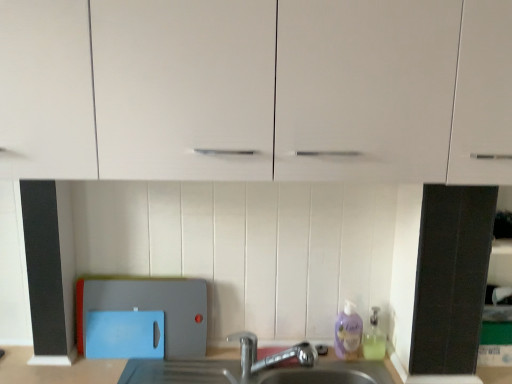
Find the location of a particular element. purple translucent liquid soap at lower right, the 2th cleaning product when ordered from right to left is located at coordinates (348, 333).

Image resolution: width=512 pixels, height=384 pixels. What are the coordinates of `purple translucent liquid soap at lower right, which is counted as the 1th cleaning product, starting from the left` in the screenshot? It's located at (348, 333).

In the image, is translucent plastic soap dispenser at lower right, which appears as the second cleaning product when viewed from the left, positioned in front of or behind purple translucent liquid soap at lower right, which is counted as the 1th cleaning product, starting from the left?

translucent plastic soap dispenser at lower right, which appears as the second cleaning product when viewed from the left, is positioned closer to the viewer than purple translucent liquid soap at lower right, which is counted as the 1th cleaning product, starting from the left.

Is translucent plastic soap dispenser at lower right, which appears as the second cleaning product when viewed from the left, next to purple translucent liquid soap at lower right, which is counted as the 1th cleaning product, starting from the left?

Yes, translucent plastic soap dispenser at lower right, which appears as the second cleaning product when viewed from the left, is with purple translucent liquid soap at lower right, which is counted as the 1th cleaning product, starting from the left.

Considering the sizes of objects translucent plastic soap dispenser at lower right, which appears as the second cleaning product when viewed from the left, and purple translucent liquid soap at lower right, the 2th cleaning product when ordered from right to left, in the image provided, who is taller, translucent plastic soap dispenser at lower right, which appears as the second cleaning product when viewed from the left, or purple translucent liquid soap at lower right, the 2th cleaning product when ordered from right to left,?

purple translucent liquid soap at lower right, the 2th cleaning product when ordered from right to left.

Locate an element on the screen. The height and width of the screenshot is (384, 512). appliance located above the silver metallic faucet at lower center (from a real-world perspective) is located at coordinates (150, 307).

Is silver metallic faucet at lower center wider than blue plastic cutting board at lower left?

Indeed, silver metallic faucet at lower center has a greater width compared to blue plastic cutting board at lower left.

Can you confirm if silver metallic faucet at lower center is shorter than blue plastic cutting board at lower left?

Correct, silver metallic faucet at lower center is not as tall as blue plastic cutting board at lower left.

Considering the points (256, 350) and (166, 318), which point is behind, point (256, 350) or point (166, 318)?

The point (256, 350) is farther from the camera.

Can you confirm if blue plastic cutting board at lower left is wider than silver metallic faucet at lower center?

No, blue plastic cutting board at lower left is not wider than silver metallic faucet at lower center.

Between blue plastic cutting board at lower left and silver metallic faucet at lower center, which one has more height?

blue plastic cutting board at lower left is taller.

The image size is (512, 384). What are the coordinates of `appliance behind the silver metallic faucet at lower center` in the screenshot? It's located at coord(150,307).

Does blue plastic cutting board at lower left contain silver metallic faucet at lower center?

No, silver metallic faucet at lower center is not surrounded by blue plastic cutting board at lower left.

Would you say white glossy cabinet at upper center is inside or outside purple translucent liquid soap at lower right, which is counted as the 1th cleaning product, starting from the left?

white glossy cabinet at upper center is not enclosed by purple translucent liquid soap at lower right, which is counted as the 1th cleaning product, starting from the left.

Based on their positions, is white glossy cabinet at upper center located to the left or right of purple translucent liquid soap at lower right, which is counted as the 1th cleaning product, starting from the left?

Based on their positions, white glossy cabinet at upper center is located to the left of purple translucent liquid soap at lower right, which is counted as the 1th cleaning product, starting from the left.

Considering the sizes of white glossy cabinet at upper center and purple translucent liquid soap at lower right, which is counted as the 1th cleaning product, starting from the left, in the image, is white glossy cabinet at upper center bigger or smaller than purple translucent liquid soap at lower right, which is counted as the 1th cleaning product, starting from the left,?

white glossy cabinet at upper center is bigger than purple translucent liquid soap at lower right, which is counted as the 1th cleaning product, starting from the left.

Considering their positions, is white glossy cabinet at upper center located in front of or behind purple translucent liquid soap at lower right, the 2th cleaning product when ordered from right to left?

Visually, white glossy cabinet at upper center is located in front of purple translucent liquid soap at lower right, the 2th cleaning product when ordered from right to left.

Is white glossy cabinet at upper center outside of translucent plastic soap dispenser at lower right, which is counted as the 1th cleaning product, starting from the right?

Indeed, white glossy cabinet at upper center is completely outside translucent plastic soap dispenser at lower right, which is counted as the 1th cleaning product, starting from the right.

Is white glossy cabinet at upper center beside translucent plastic soap dispenser at lower right, which appears as the second cleaning product when viewed from the left?

No, white glossy cabinet at upper center is not in contact with translucent plastic soap dispenser at lower right, which appears as the second cleaning product when viewed from the left.

Is white glossy cabinet at upper center smaller than translucent plastic soap dispenser at lower right, which is counted as the 1th cleaning product, starting from the right?

No.

From the image's perspective, is white glossy cabinet at upper center beneath translucent plastic soap dispenser at lower right, which appears as the second cleaning product when viewed from the left?

Actually, white glossy cabinet at upper center appears above translucent plastic soap dispenser at lower right, which appears as the second cleaning product when viewed from the left, in the image.

Between white glossy cabinet at upper center and silver metallic faucet at lower center, which one is positioned behind?

silver metallic faucet at lower center is more distant.

From a real-world perspective, who is located higher, white glossy cabinet at upper center or silver metallic faucet at lower center?

white glossy cabinet at upper center is physically above.

This screenshot has height=384, width=512. I want to click on tap below the white glossy cabinet at upper center (from the image's perspective), so click(271, 355).

Considering the relative positions of white glossy cabinet at upper center and silver metallic faucet at lower center in the image provided, is white glossy cabinet at upper center to the right of silver metallic faucet at lower center from the viewer's perspective?

No.

From a real-world perspective, is silver metallic faucet at lower center on top of white glossy cabinet at upper center?

Actually, silver metallic faucet at lower center is physically below white glossy cabinet at upper center in the real world.

Who is more distant, silver metallic faucet at lower center or white glossy cabinet at upper center?

silver metallic faucet at lower center is further from the camera.

Image resolution: width=512 pixels, height=384 pixels. There is a translucent plastic soap dispenser at lower right, which appears as the second cleaning product when viewed from the left. In order to click on cleaning product above it (from a real-world perspective) in this screenshot , I will do `click(348, 333)`.

The height and width of the screenshot is (384, 512). I want to click on tap below the blue plastic cutting board at lower left (from a real-world perspective), so click(x=271, y=355).

Considering their positions, is white glossy cabinet at upper center positioned further to blue plastic cutting board at lower left than purple translucent liquid soap at lower right, the 2th cleaning product when ordered from right to left?

white glossy cabinet at upper center.

Estimate the real-world distances between objects in this image. Which object is closer to blue plastic cutting board at lower left, purple translucent liquid soap at lower right, the 2th cleaning product when ordered from right to left, or white glossy cabinet at upper center?

purple translucent liquid soap at lower right, the 2th cleaning product when ordered from right to left, is positioned closer to the anchor blue plastic cutting board at lower left.

When comparing their distances from silver metallic faucet at lower center, does blue plastic cutting board at lower left or white glossy cabinet at upper center seem further?

white glossy cabinet at upper center is further to silver metallic faucet at lower center.

From the image, which object appears to be nearer to blue plastic cutting board at lower left, silver metallic faucet at lower center or white glossy cabinet at upper center?

Among the two, silver metallic faucet at lower center is located nearer to blue plastic cutting board at lower left.

Based on the photo, from the image, which object appears to be farther from purple translucent liquid soap at lower right, the 2th cleaning product when ordered from right to left, blue plastic cutting board at lower left or silver metallic faucet at lower center?

blue plastic cutting board at lower left lies further to purple translucent liquid soap at lower right, the 2th cleaning product when ordered from right to left, than the other object.

Based on the photo, looking at the image, which one is located further to silver metallic faucet at lower center, white glossy cabinet at upper center or purple translucent liquid soap at lower right, the 2th cleaning product when ordered from right to left?

white glossy cabinet at upper center is positioned further to the anchor silver metallic faucet at lower center.

Considering their positions, is purple translucent liquid soap at lower right, which is counted as the 1th cleaning product, starting from the left, positioned further to silver metallic faucet at lower center than translucent plastic soap dispenser at lower right, which appears as the second cleaning product when viewed from the left?

translucent plastic soap dispenser at lower right, which appears as the second cleaning product when viewed from the left.

Considering their positions, is white glossy cabinet at upper center positioned further to translucent plastic soap dispenser at lower right, which is counted as the 1th cleaning product, starting from the right, than silver metallic faucet at lower center?

Among the two, white glossy cabinet at upper center is located further to translucent plastic soap dispenser at lower right, which is counted as the 1th cleaning product, starting from the right.

Locate an element on the screen. appliance between white glossy cabinet at upper center and silver metallic faucet at lower center from top to bottom is located at coordinates (150, 307).

Find the location of a particular element. The width and height of the screenshot is (512, 384). cleaning product situated between blue plastic cutting board at lower left and translucent plastic soap dispenser at lower right, which is counted as the 1th cleaning product, starting from the right, from left to right is located at coordinates [348, 333].

Locate an element on the screen. This screenshot has height=384, width=512. cleaning product between white glossy cabinet at upper center and translucent plastic soap dispenser at lower right, which is counted as the 1th cleaning product, starting from the right, vertically is located at coordinates (348, 333).

The height and width of the screenshot is (384, 512). In order to click on tap between blue plastic cutting board at lower left and translucent plastic soap dispenser at lower right, which is counted as the 1th cleaning product, starting from the right, in the horizontal direction in this screenshot , I will do `click(271, 355)`.